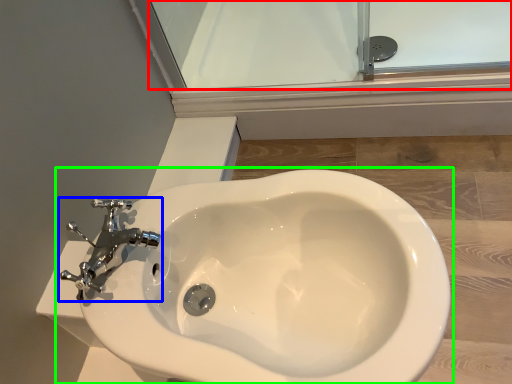
Question: Which object is the farthest from glass door (highlighted by a red box)? Choose among these: tap (highlighted by a blue box) or toilet (highlighted by a green box).

Choices:
 (A) tap
 (B) toilet

Answer: (A)